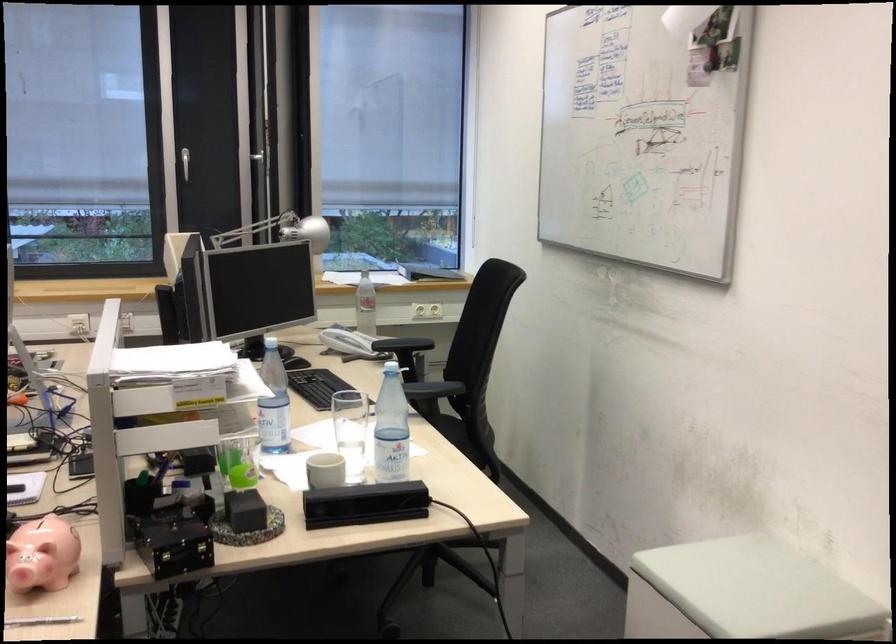
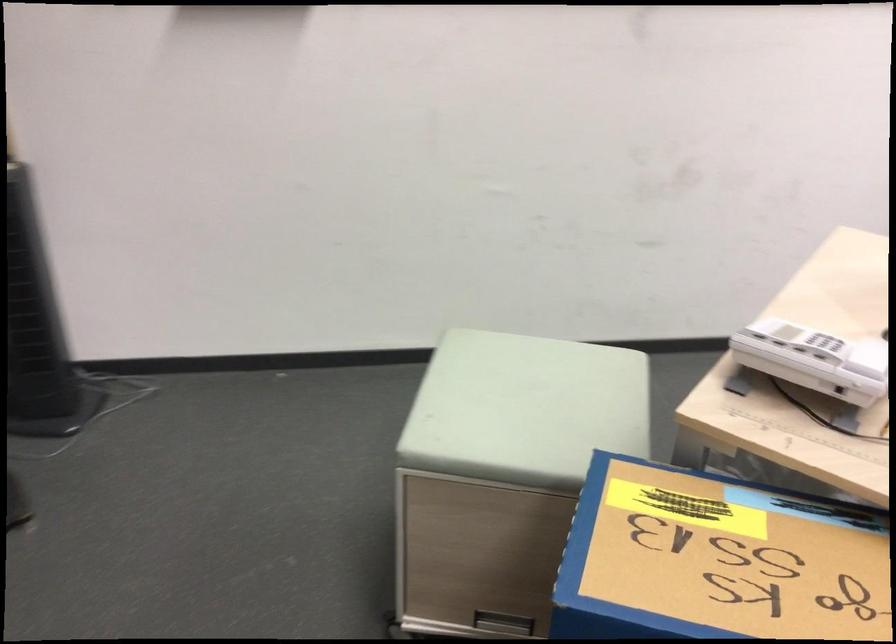
The first image is from the beginning of the video and the second image is from the end. How did the camera likely rotate when shooting the video?

The camera's rotation is toward left-down.